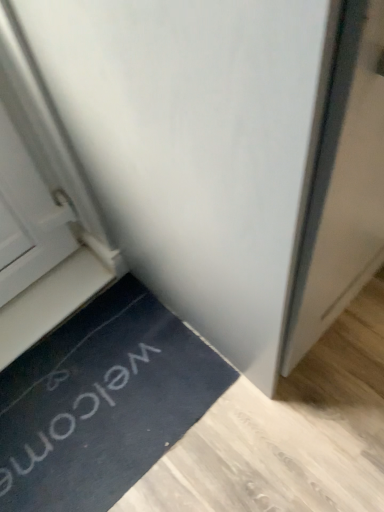
Question: Is white plastic stairwell at lower left smaller than white matte door at center?

Choices:
 (A) yes
 (B) no

Answer: (A)

Question: Is there a large distance between white plastic stairwell at lower left and white matte door at center?

Choices:
 (A) yes
 (B) no

Answer: (B)

Question: Considering the relative sizes of white plastic stairwell at lower left and white matte door at center in the image provided, is white plastic stairwell at lower left taller than white matte door at center?

Choices:
 (A) yes
 (B) no

Answer: (B)

Question: Is white plastic stairwell at lower left shorter than white matte door at center?

Choices:
 (A) no
 (B) yes

Answer: (B)

Question: Considering the relative sizes of white plastic stairwell at lower left and white matte door at center in the image provided, is white plastic stairwell at lower left thinner than white matte door at center?

Choices:
 (A) no
 (B) yes

Answer: (B)

Question: Does white plastic stairwell at lower left appear on the right side of white matte door at center?

Choices:
 (A) yes
 (B) no

Answer: (B)

Question: Is white matte door at center wider than black rubber doormat at lower left?

Choices:
 (A) yes
 (B) no

Answer: (A)

Question: Considering the relative positions of white matte door at center and black rubber doormat at lower left in the image provided, is white matte door at center to the right of black rubber doormat at lower left from the viewer's perspective?

Choices:
 (A) yes
 (B) no

Answer: (A)

Question: Is the surface of white matte door at center in direct contact with black rubber doormat at lower left?

Choices:
 (A) no
 (B) yes

Answer: (A)

Question: Can you confirm if white matte door at center is bigger than black rubber doormat at lower left?

Choices:
 (A) yes
 (B) no

Answer: (A)

Question: Does white matte door at center turn towards black rubber doormat at lower left?

Choices:
 (A) no
 (B) yes

Answer: (A)

Question: Is white matte door at center far from black rubber doormat at lower left?

Choices:
 (A) no
 (B) yes

Answer: (A)

Question: Considering the relative sizes of white plastic stairwell at lower left and black rubber doormat at lower left in the image provided, is white plastic stairwell at lower left shorter than black rubber doormat at lower left?

Choices:
 (A) yes
 (B) no

Answer: (A)